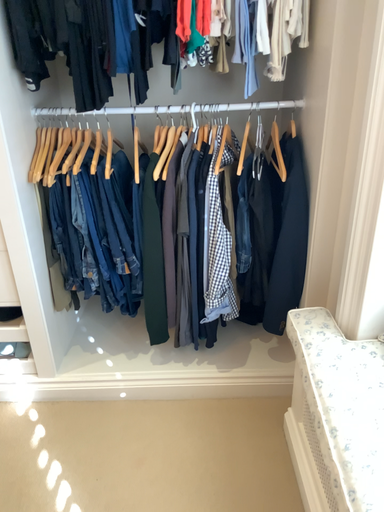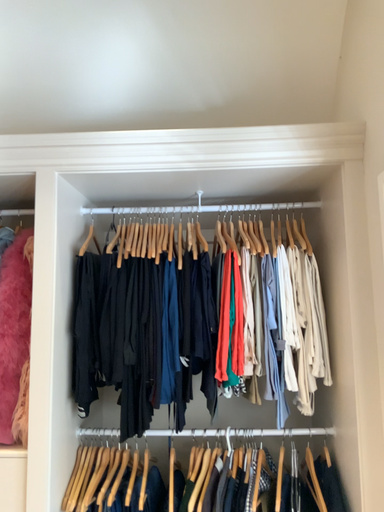
Question: Which way did the camera rotate in the video?

Choices:
 (A) rotated upward
 (B) rotated downward

Answer: (A)